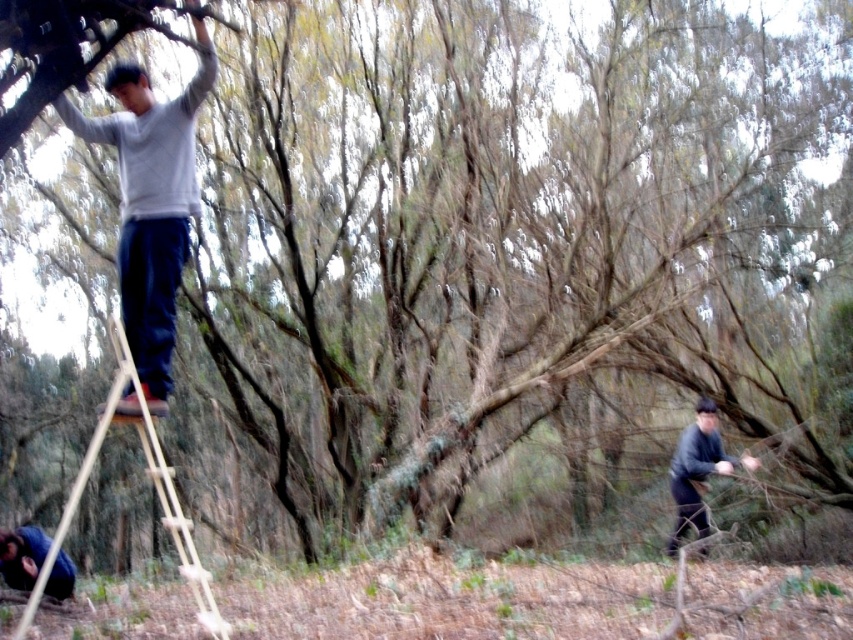
You are a hiker who has just arrived at the wooded area and see the wooden natural ladder at upper left and the blue denim jacket at lower left. Which object would you estimate to be physically bigger in size?

The wooden natural ladder at upper left is larger in size compared to the blue denim jacket at lower left according to the description.

You are standing in the wooded area and want to walk from point A to point B. Point A is at coordinates point (x=91, y=461) and point B is at coordinates point (x=64, y=595). Which point should you start at to be closer to your starting position?

You should start at point A at coordinates point (x=91, y=461) because it is closer to your current position as it is further to the viewer compared to point B at coordinates point (x=64, y=595).

You are an observer in the scene and see the light gray sweater at upper left and the dark gray sweater at lower right. Which sweater is positioned more to the left side of the image?

The light gray sweater at upper left is positioned more to the left side of the image.